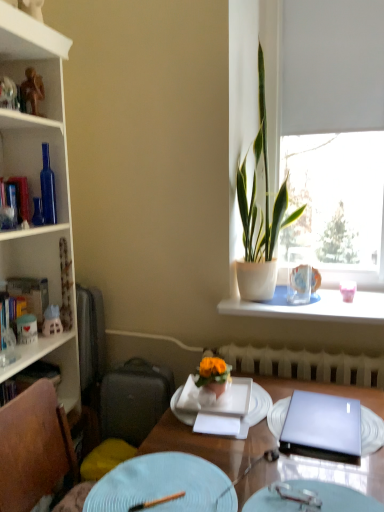
Identify the location of vacant area that lies between metallic silver fork at center, the 2th tableware positioned from the front, and white paper at center. This screenshot has width=384, height=512. (256, 461).